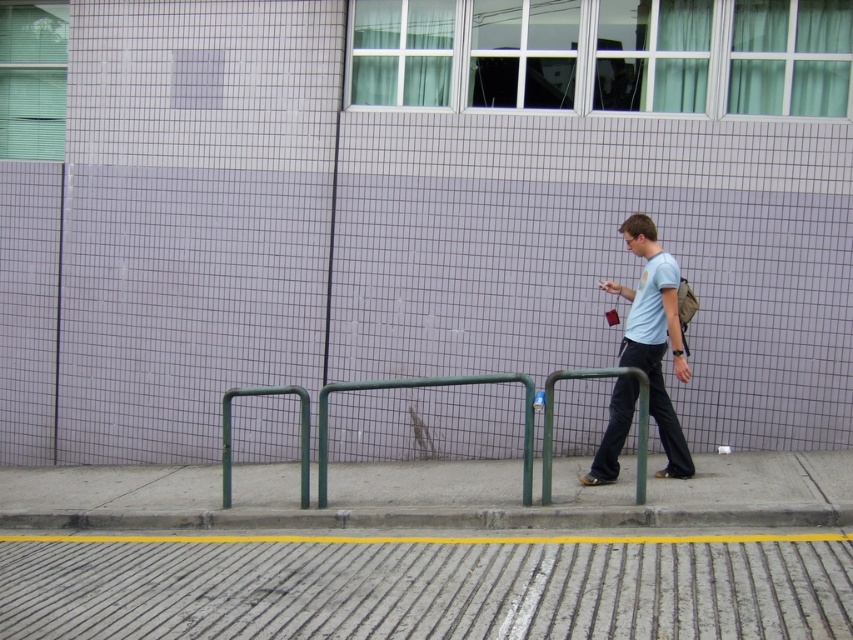
Is concrete textured pavement at lower center in front of green metal rail at center?

Yes, it is.

Is point (347, 593) closer to camera compared to point (549, 426)?

Yes, point (347, 593) is closer to viewer.

Does point (699, 637) lie in front of point (251, 392)?

Yes, point (699, 637) is in front of point (251, 392).

Image resolution: width=853 pixels, height=640 pixels. In order to click on concrete textured pavement at lower center in this screenshot , I will do `click(425, 589)`.

Between gray concrete curb at lower center and light blue t-shirt at center-right, which one appears on the left side from the viewer's perspective?

gray concrete curb at lower center is more to the left.

Who is shorter, gray concrete curb at lower center or light blue t-shirt at center-right?

gray concrete curb at lower center is shorter.

Who is more forward, (93, 520) or (596, 451)?

Positioned in front is point (93, 520).

This screenshot has height=640, width=853. In order to click on gray concrete curb at lower center in this screenshot , I will do `click(436, 516)`.

Can you confirm if light blue t-shirt at center-right is positioned above green metal rail at center?

Indeed, light blue t-shirt at center-right is positioned over green metal rail at center.

Which is more to the right, light blue t-shirt at center-right or green metal rail at center?

light blue t-shirt at center-right

Who is more forward, (595, 480) or (323, 461)?

Point (323, 461)

Locate an element on the screen. The width and height of the screenshot is (853, 640). light blue t-shirt at center-right is located at coordinates (654, 336).